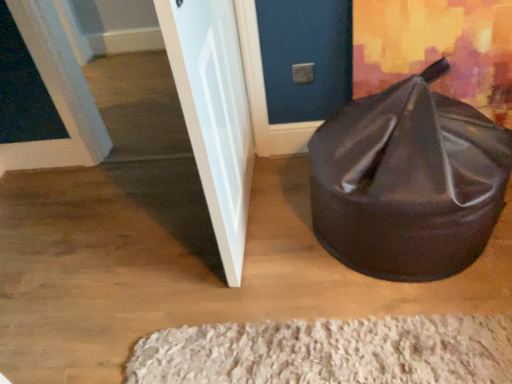
Locate an element on the screen. This screenshot has height=384, width=512. vacant area that is situated to the right of white glossy door at left, which is the 1th door in right-to-left order is located at coordinates (285, 208).